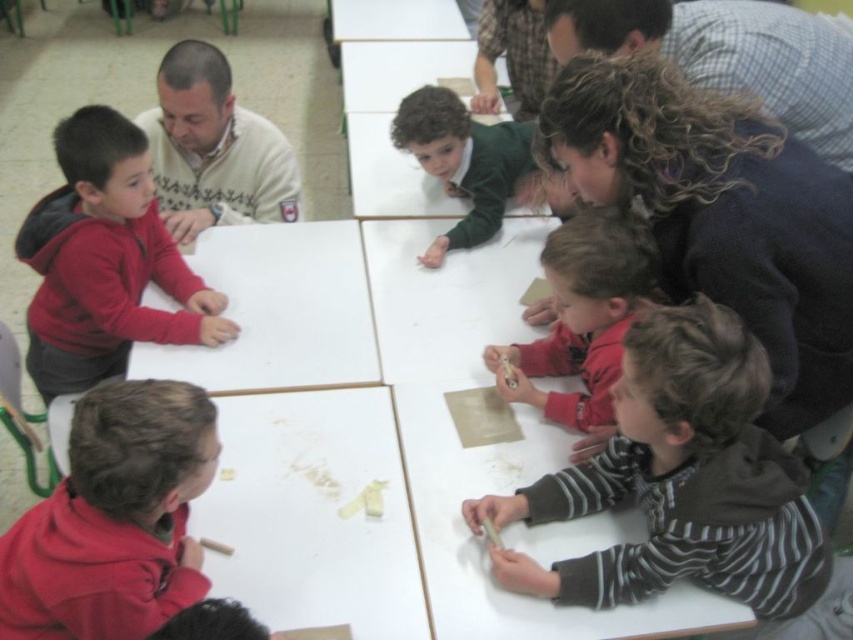
Is matte red hoodie at left to the right of green matte shirt at upper center from the viewer's perspective?

No, matte red hoodie at left is not to the right of green matte shirt at upper center.

Does point (161, 330) come closer to viewer compared to point (474, 237)?

That is True.

Is point (175, 257) positioned behind point (491, 173)?

No, it is not.

This screenshot has width=853, height=640. I want to click on matte red hoodie at left, so click(x=105, y=260).

Image resolution: width=853 pixels, height=640 pixels. Describe the element at coordinates (679, 481) in the screenshot. I see `striped fabric shirt at lower right` at that location.

What do you see at coordinates (679, 481) in the screenshot? This screenshot has width=853, height=640. I see `striped fabric shirt at lower right` at bounding box center [679, 481].

Find the location of a particular element. The image size is (853, 640). striped fabric shirt at lower right is located at coordinates (x=679, y=481).

Can you confirm if striped sweater at lower right is smaller than white matte table at center?

Indeed, striped sweater at lower right has a smaller size compared to white matte table at center.

This screenshot has width=853, height=640. What do you see at coordinates (584, 317) in the screenshot?
I see `striped sweater at lower right` at bounding box center [584, 317].

Is point (584, 236) closer to viewer compared to point (444, 49)?

Yes.

At what (x,y) coordinates should I click in order to perform the action: click on striped sweater at lower right. Please return your answer as a coordinate pair (x, y). This screenshot has height=640, width=853. Looking at the image, I should click on (584, 317).